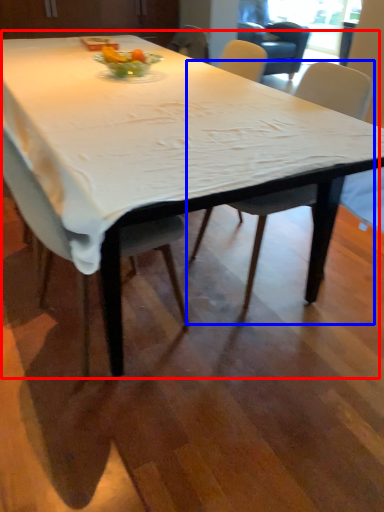
Question: Which of the following is the closest to the observer, table (highlighted by a red box) or chair (highlighted by a blue box)?

Choices:
 (A) table
 (B) chair

Answer: (A)